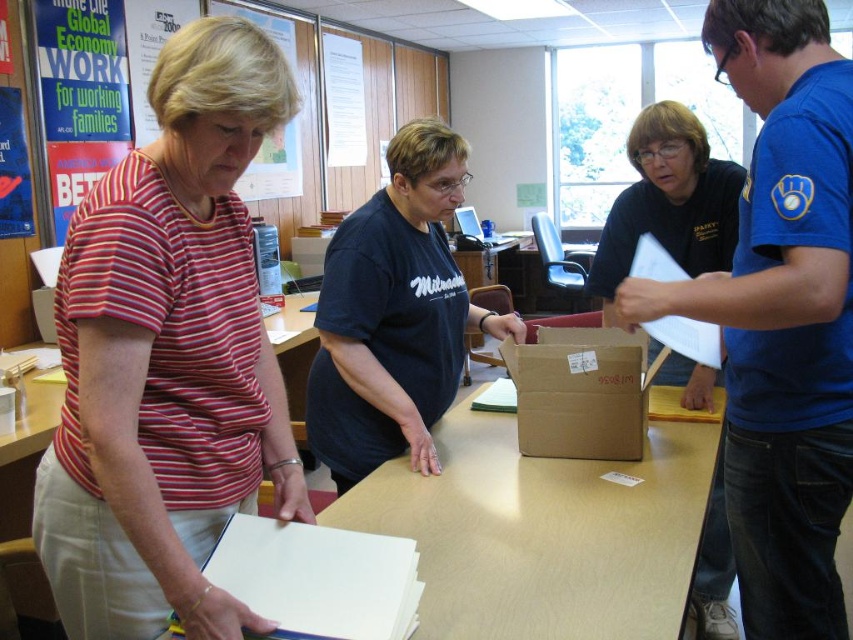
You are standing in an office and see the striped cotton shirt at left. If you want to hand them a document, is the distance within comfortable arm reach?

The distance of striped cotton shirt at left from viewer is 37.87 inches, which is within comfortable arm reach for handing over a document.

You are an office worker who needs to deliver a document to the person wearing the striped cotton shirt at left. You are currently standing near the brown cardboard box at center. Which direction should you move to reach them?

Since the striped cotton shirt at left is closer to the viewer than the brown cardboard box at center, you should move towards the direction of the striped cotton shirt at left, which is closer to your current position near the brown cardboard box at center.

What is the location of the point with coordinates point at (781, 316)?

The point at (781, 316) is located on the blue jersey at right.